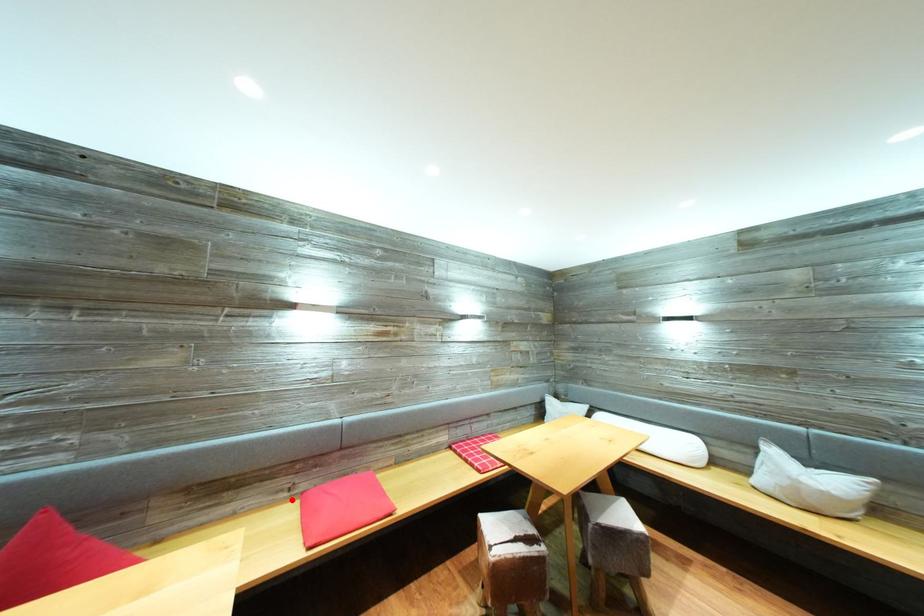
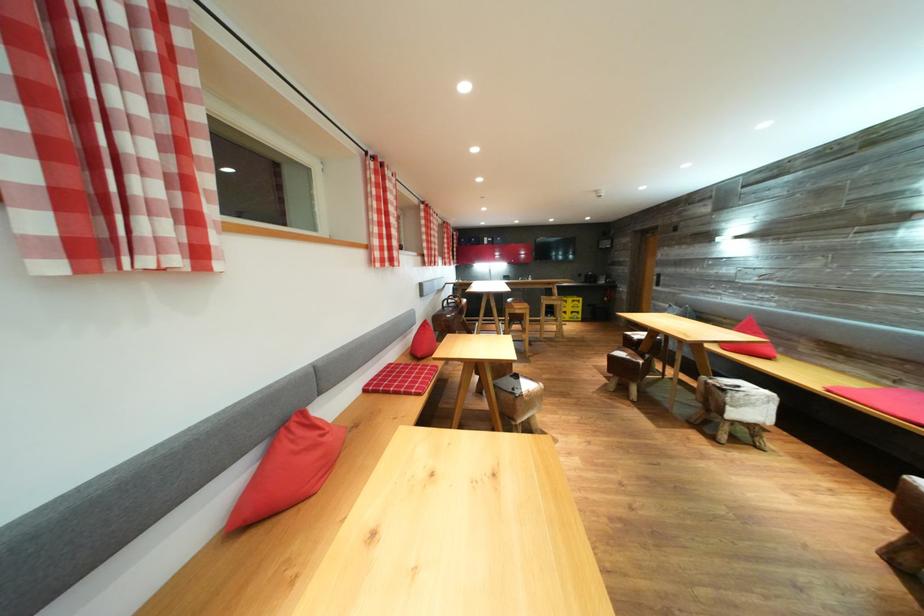
The point at the highlighted location is marked in the first image. Where is the corresponding point in the second image?

(895, 389)